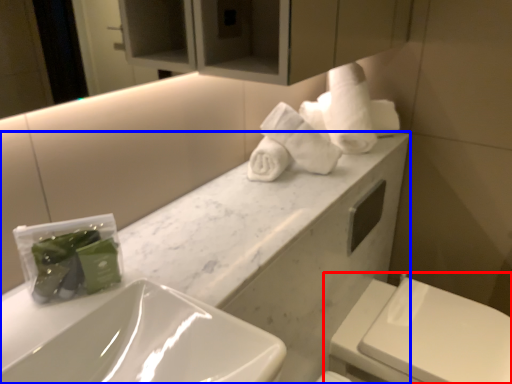
Question: Among these objects, which one is farthest to the camera, toilet (highlighted by a red box) or porcelain (highlighted by a blue box)?

Choices:
 (A) toilet
 (B) porcelain

Answer: (A)